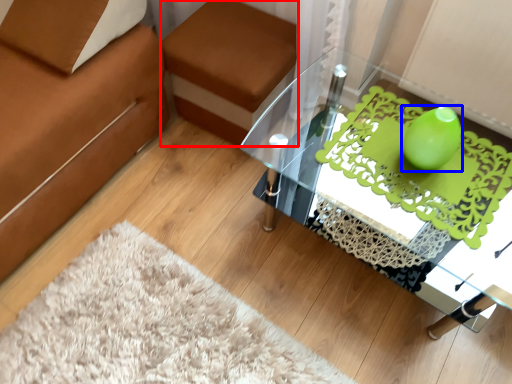
Question: Which object is closer to the camera taking this photo, footrest (highlighted by a red box) or teal (highlighted by a blue box)?

Choices:
 (A) footrest
 (B) teal

Answer: (B)